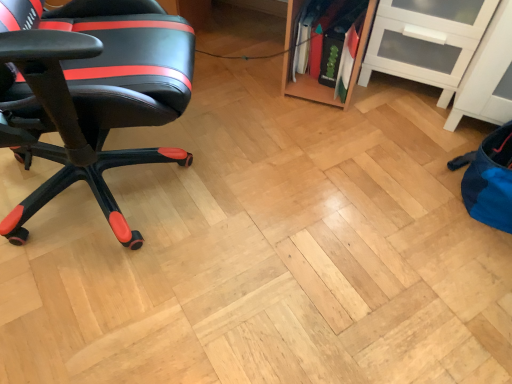
Question: Relative to black leather chair at left, is white glossy cabinet at upper right in front or behind?

Choices:
 (A) behind
 (B) front

Answer: (A)

Question: Is white glossy cabinet at upper right situated inside black leather chair at left or outside?

Choices:
 (A) outside
 (B) inside

Answer: (A)

Question: Considering the relative positions of white glossy cabinet at upper right and black leather chair at left in the image provided, is white glossy cabinet at upper right to the left or to the right of black leather chair at left?

Choices:
 (A) right
 (B) left

Answer: (A)

Question: In terms of width, does black leather chair at left look wider or thinner when compared to white glossy cabinet at upper right?

Choices:
 (A) thin
 (B) wide

Answer: (B)

Question: Considering the positions of black leather chair at left and white glossy cabinet at upper right in the image, is black leather chair at left bigger or smaller than white glossy cabinet at upper right?

Choices:
 (A) small
 (B) big

Answer: (B)

Question: Is point (108, 200) closer or farther from the camera than point (461, 54)?

Choices:
 (A) closer
 (B) farther

Answer: (A)

Question: Would you say black leather chair at left is inside or outside white glossy cabinet at upper right?

Choices:
 (A) inside
 (B) outside

Answer: (B)